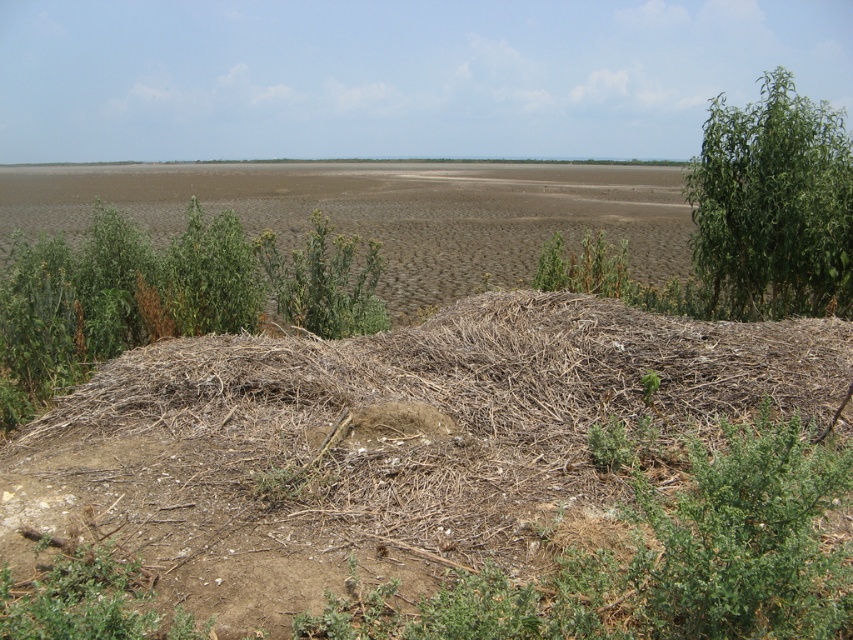
Question: Which of the following is the closest to the observer?

Choices:
 (A) green leafy plant at left
 (B) green leafy tree at upper right

Answer: (B)

Question: Is green leafy plant at left thinner than green leafy tree at upper right?

Choices:
 (A) yes
 (B) no

Answer: (A)

Question: Among these points, which one is farthest from the camera?

Choices:
 (A) (51, 289)
 (B) (807, 184)

Answer: (B)

Question: Can you confirm if green leafy plant at left is smaller than green leafy tree at upper right?

Choices:
 (A) yes
 (B) no

Answer: (A)

Question: Is the position of green leafy plant at left less distant than that of green leafy tree at upper right?

Choices:
 (A) no
 (B) yes

Answer: (A)